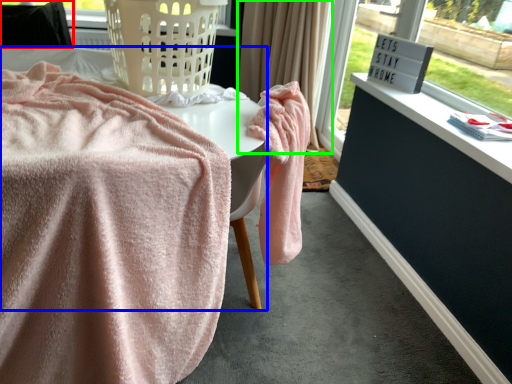
Question: Based on their relative distances, which object is farther from furniture (highlighted by a red box)? Choose from table (highlighted by a blue box) and curtain (highlighted by a green box).

Choices:
 (A) table
 (B) curtain

Answer: (B)